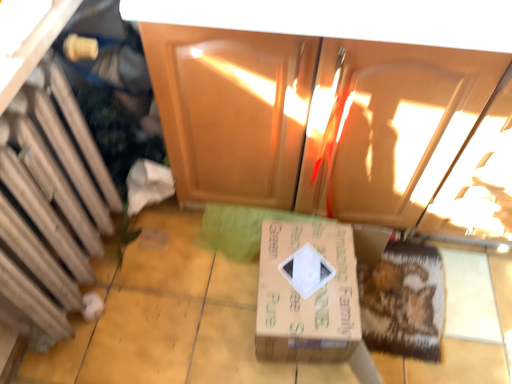
Question: Considering the positions of wooden cabinet at left, which appears as the 1th cabinetry when viewed from the left, and brown cardboard box at center in the image, is wooden cabinet at left, which appears as the 1th cabinetry when viewed from the left, taller or shorter than brown cardboard box at center?

Choices:
 (A) tall
 (B) short

Answer: (A)

Question: Visually, is wooden cabinet at left, placed as the second cabinetry when sorted from right to left, positioned to the left or to the right of brown cardboard box at center?

Choices:
 (A) left
 (B) right

Answer: (A)

Question: Which object is positioned farthest from the wooden cabinet at left, placed as the second cabinetry when sorted from right to left?

Choices:
 (A) brown cardboard box at center
 (B) matte wood cabinet at center, acting as the first cabinetry starting from the right

Answer: (A)

Question: Which of these objects is positioned closest to the wooden cabinet at left, which appears as the 1th cabinetry when viewed from the left?

Choices:
 (A) matte wood cabinet at center, the 2th cabinetry viewed from the left
 (B) brown cardboard box at center

Answer: (A)